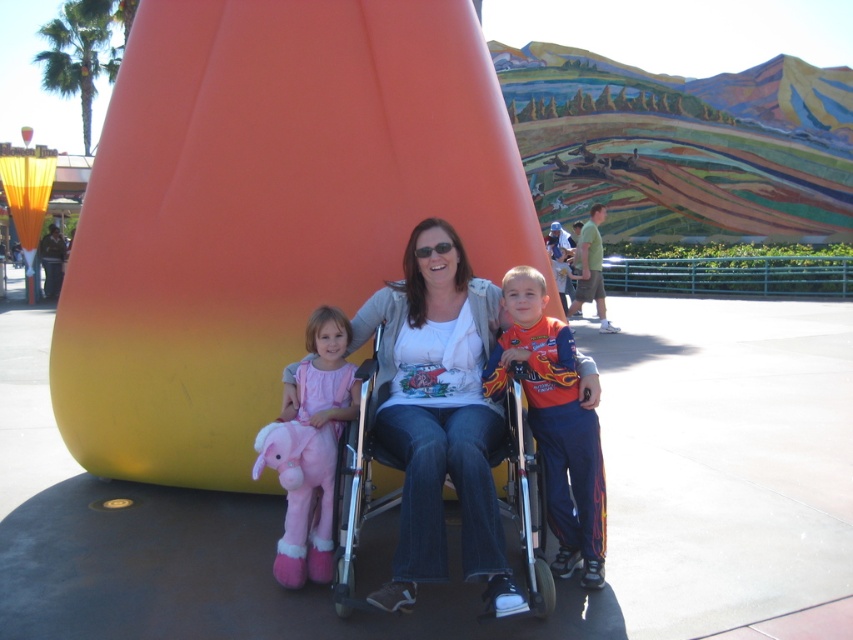
This screenshot has height=640, width=853. What do you see at coordinates (555, 422) in the screenshot?
I see `flame-patterned jersey at center` at bounding box center [555, 422].

Is flame-patterned jersey at center shorter than metallic silver wheelchair at center?

Incorrect, flame-patterned jersey at center's height does not fall short of metallic silver wheelchair at center's.

Is point (566, 524) closer to viewer compared to point (350, 493)?

No, it is not.

The width and height of the screenshot is (853, 640). What are the coordinates of `flame-patterned jersey at center` in the screenshot? It's located at (555, 422).

Who is more distant from viewer, (547, 609) or (325, 536)?

The point (325, 536) is behind.

Who is lower down, metallic silver wheelchair at center or pink plush toy at left?

metallic silver wheelchair at center is lower down.

Describe the element at coordinates (357, 484) in the screenshot. I see `metallic silver wheelchair at center` at that location.

The height and width of the screenshot is (640, 853). Find the location of `metallic silver wheelchair at center`. metallic silver wheelchair at center is located at coordinates (357, 484).

Does flame-patterned jersey at center have a larger size compared to pink plush toy at left?

Yes.

Is flame-patterned jersey at center above pink plush toy at left?

Correct, flame-patterned jersey at center is located above pink plush toy at left.

The height and width of the screenshot is (640, 853). What do you see at coordinates (555, 422) in the screenshot?
I see `flame-patterned jersey at center` at bounding box center [555, 422].

Find the location of `flame-patterned jersey at center`. flame-patterned jersey at center is located at coordinates (555, 422).